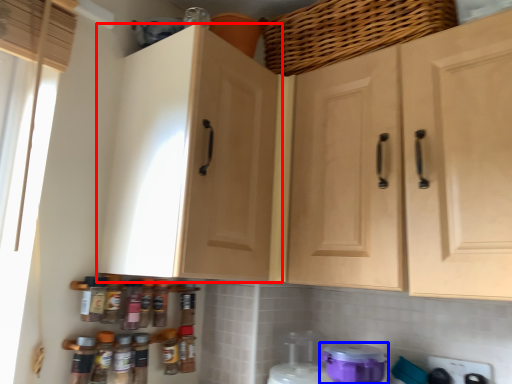
Question: Among these objects, which one is farthest to the camera, cabinetry (highlighted by a red box) or appliance (highlighted by a blue box)?

Choices:
 (A) cabinetry
 (B) appliance

Answer: (B)